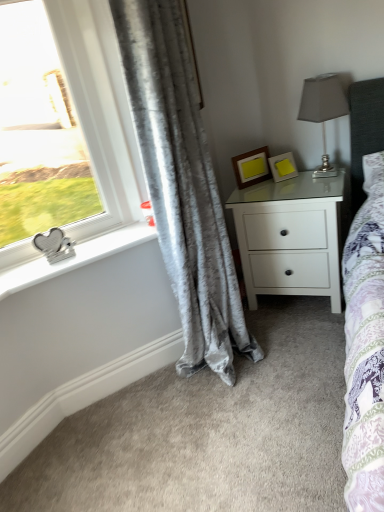
Identify the location of free space that is to the left of satin silver table lamp at upper right. (284, 188).